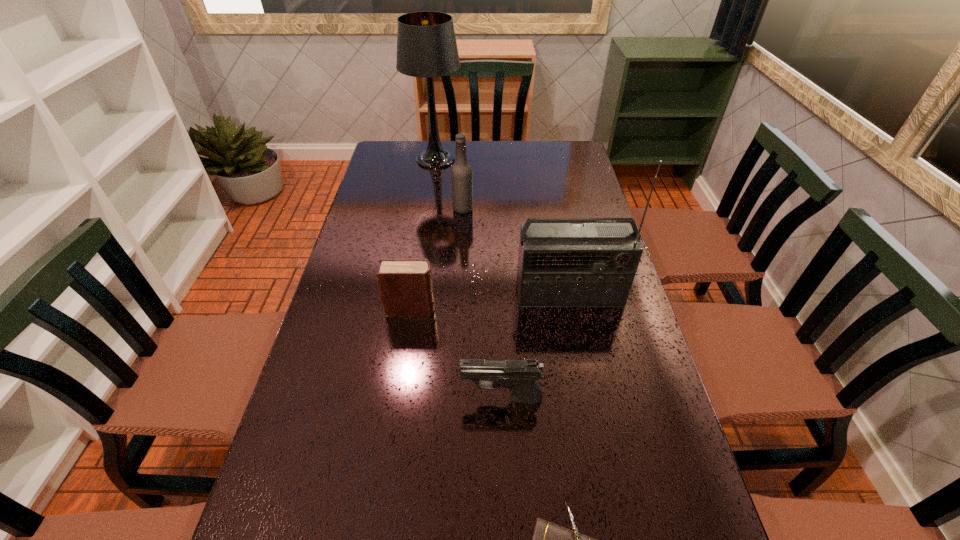
Locate an element on the screen. This screenshot has height=540, width=960. object that is the fourth closest one to the radio receiver is located at coordinates (549, 539).

The width and height of the screenshot is (960, 540). What are the coordinates of `vacant space that satisfies the following two spatial constraints: 1. on the front panel of the second tallest object; 2. on the spine side of the taller diary` in the screenshot? It's located at (572, 309).

Image resolution: width=960 pixels, height=540 pixels. What are the coordinates of `vacant region that satisfies the following two spatial constraints: 1. on the front side of the farthest object; 2. on the spine side of the left diary` in the screenshot? It's located at (414, 309).

This screenshot has width=960, height=540. I want to click on vacant position in the image that satisfies the following two spatial constraints: 1. on the front panel of the radio receiver; 2. at the barrel of the fifth tallest object, so click(590, 399).

At what (x,y) coordinates should I click in order to perform the action: click on free region that satisfies the following two spatial constraints: 1. on the front panel of the fifth shortest object; 2. at the barrel of the pistol. Please return your answer as a coordinate pair (x, y). Image resolution: width=960 pixels, height=540 pixels. Looking at the image, I should click on (x=590, y=399).